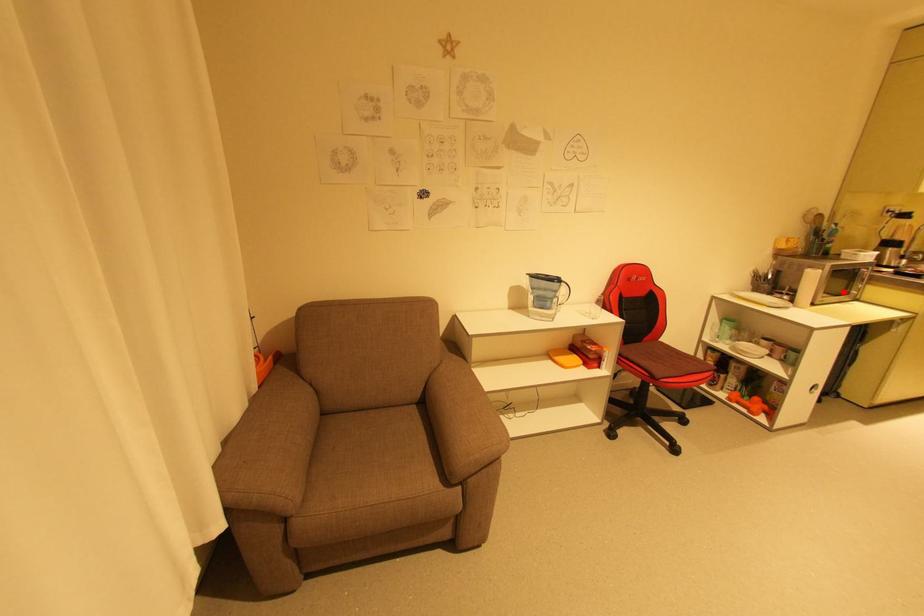
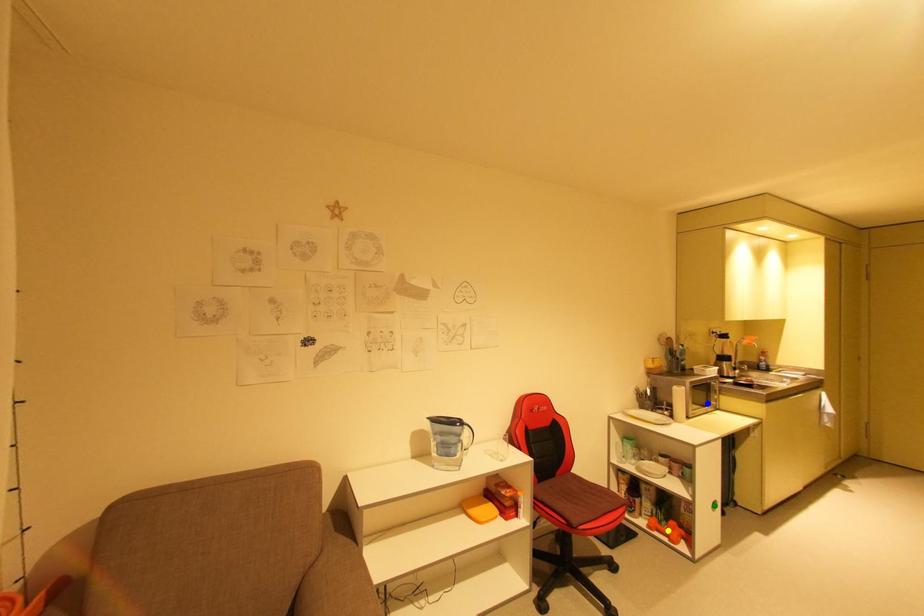
Question: I am providing you with two images of the same scene from different viewpoints. A red point is marked on the first image. You are given multiple points on the second image. Which point in image 2 represents the same 3d spot as the red point in image 1?

Choices:
 (A) yellow point
 (B) blue point
 (C) green point

Answer: (B)